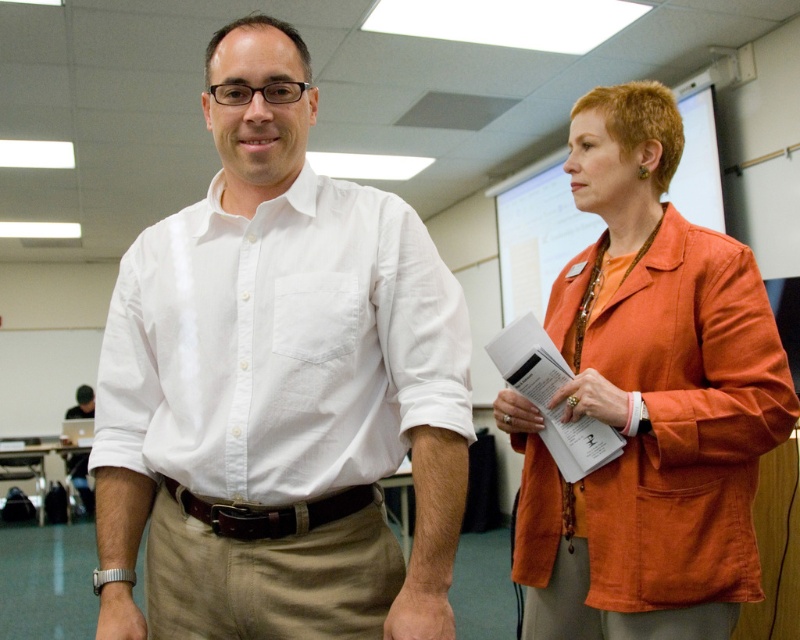
Can you confirm if white cotton shirt at center is shorter than orange fabric bulletin board at upper right?

Indeed, white cotton shirt at center has a lesser height compared to orange fabric bulletin board at upper right.

What do you see at coordinates (278, 388) in the screenshot?
I see `white cotton shirt at center` at bounding box center [278, 388].

Locate an element on the screen. The image size is (800, 640). white cotton shirt at center is located at coordinates (278, 388).

Is white cotton shirt at center shorter than orange fabric jacket at upper right?

Yes, white cotton shirt at center is shorter than orange fabric jacket at upper right.

Does white cotton shirt at center appear on the right side of orange fabric jacket at upper right?

In fact, white cotton shirt at center is to the left of orange fabric jacket at upper right.

Which is behind, point (186, 456) or point (632, 401)?

Point (632, 401)

Locate an element on the screen. The width and height of the screenshot is (800, 640). white cotton shirt at center is located at coordinates (278, 388).

Does point (616, 385) lie in front of point (280, 538)?

No, (616, 385) is behind (280, 538).

Who is higher up, orange fabric jacket at upper right or brown leather belt at center?

orange fabric jacket at upper right is higher up.

Between point (668, 504) and point (296, 513), which one is positioned behind?

Positioned behind is point (668, 504).

Identify the location of orange fabric jacket at upper right. (648, 401).